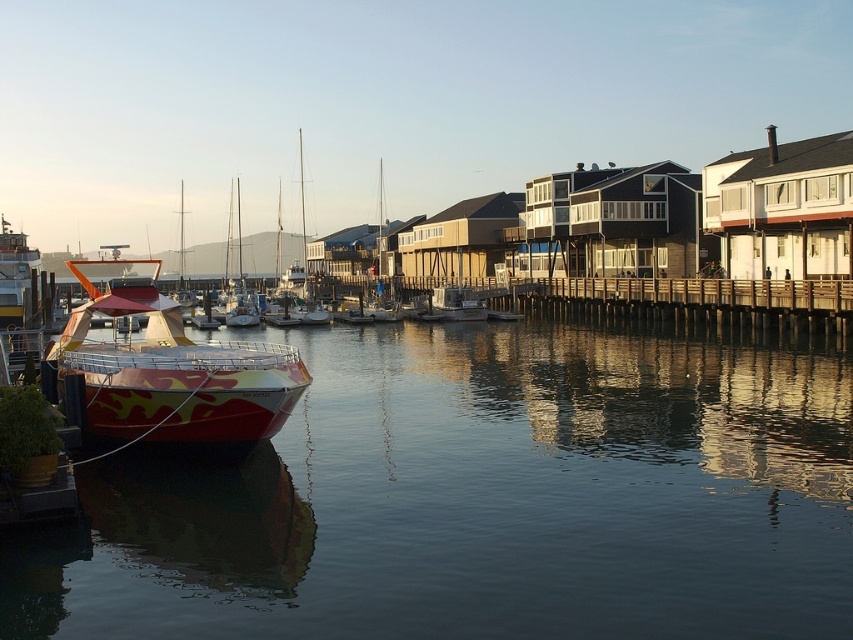
You are a photographer planning to capture both the shiny white sailboat at center and the white glossy boat at center in a single frame. Given their sizes, which boat should you position closer to the camera to ensure both appear balanced in the photo?

To balance the shiny white sailboat at center and the white glossy boat at center in the photo, you should position the smaller white glossy boat at center closer to the camera since the shiny white sailboat at center is larger and would need to be farther back to appear proportionally similar in size.

You are a photographer planning to capture the reflection of the camouflage paintwork boat at left and the wooden at right in the water. Which boat will have a more complete reflection? Explain your reasoning based on their positions.

The camouflage paintwork boat at left will have a more complete reflection because it is positioned over the wooden at right, meaning it is closer to the water surface where reflections are clearer and less obstructed.